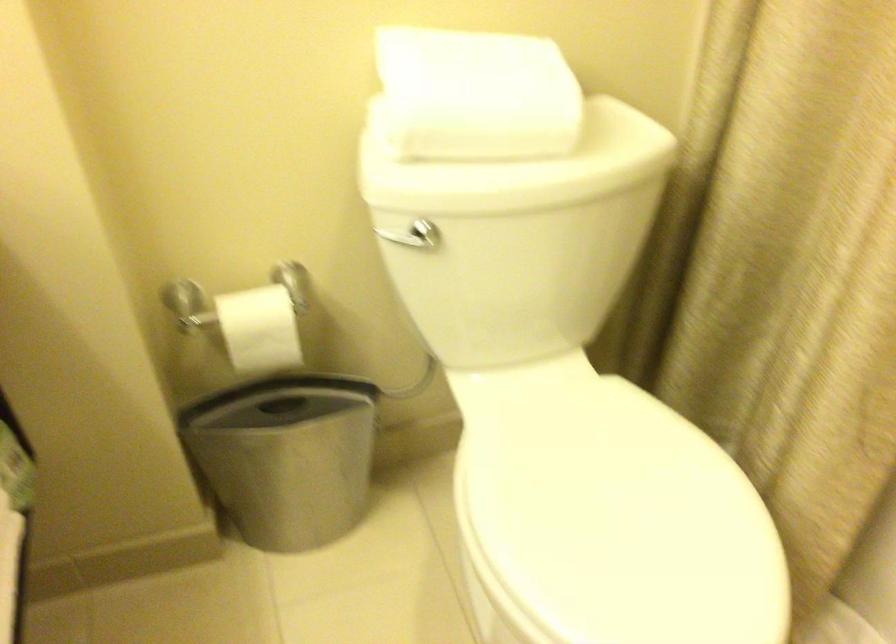
Describe the element at coordinates (519, 167) in the screenshot. I see `the toilet tank lid` at that location.